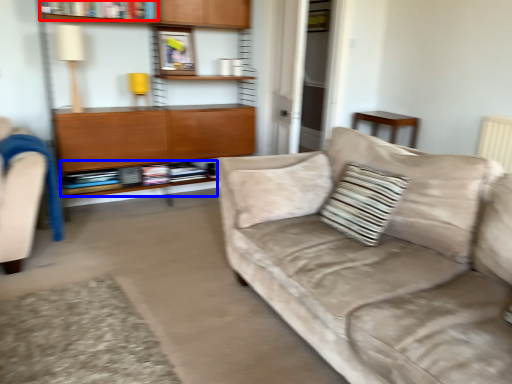
Question: Which object appears closest to the camera in this image, book (highlighted by a red box) or book (highlighted by a blue box)?

Choices:
 (A) book
 (B) book

Answer: (A)